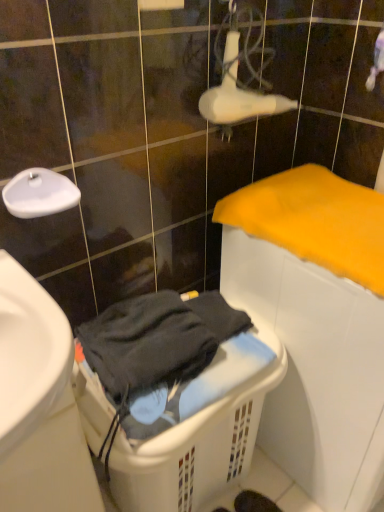
The height and width of the screenshot is (512, 384). Find the location of `white plastic laundry basket at lower center`. white plastic laundry basket at lower center is located at coordinates (174, 397).

The height and width of the screenshot is (512, 384). Find the location of `yellow soft cloth at right`. yellow soft cloth at right is located at coordinates (314, 221).

The width and height of the screenshot is (384, 512). Describe the element at coordinates (39, 193) in the screenshot. I see `white glossy faucet at upper left` at that location.

Where is `white plastic laundry basket at lower center`? The height and width of the screenshot is (512, 384). white plastic laundry basket at lower center is located at coordinates (174, 397).

Considering the relative sizes of white plastic laundry basket at lower center and white glossy faucet at upper left in the image provided, is white plastic laundry basket at lower center thinner than white glossy faucet at upper left?

No, white plastic laundry basket at lower center is not thinner than white glossy faucet at upper left.

Is white plastic laundry basket at lower center with white glossy faucet at upper left?

No, white plastic laundry basket at lower center is not making contact with white glossy faucet at upper left.

Can you confirm if white plastic laundry basket at lower center is smaller than white glossy faucet at upper left?

Incorrect, white plastic laundry basket at lower center is not smaller in size than white glossy faucet at upper left.

How much distance is there between white plastic laundry basket at lower center and white glossy faucet at upper left?

white plastic laundry basket at lower center is 20.87 inches away from white glossy faucet at upper left.

At what (x,y) coordinates should I click in order to perform the action: click on laundry basket below the white glossy faucet at upper left (from the image's perspective). Please return your answer as a coordinate pair (x, y). Looking at the image, I should click on (174, 397).

Is white glossy faucet at upper left not inside white plastic laundry basket at lower center?

Yes, white glossy faucet at upper left is not within white plastic laundry basket at lower center.

How far apart are white glossy faucet at upper left and white plastic laundry basket at lower center?

The distance of white glossy faucet at upper left from white plastic laundry basket at lower center is 20.87 inches.

Who is bigger, white glossy faucet at upper left or white plastic laundry basket at lower center?

Bigger between the two is white plastic laundry basket at lower center.

From the picture: Is there a large distance between yellow soft cloth at right and white plastic laundry basket at lower center?

No.

Which point is more distant from viewer, (261, 188) or (108, 468)?

The point (261, 188) is farther from the camera.

Is white glossy faucet at upper left oriented away from yellow soft cloth at right?

No, white glossy faucet at upper left is not facing away from yellow soft cloth at right.

Based on their sizes in the image, would you say white glossy faucet at upper left is bigger or smaller than yellow soft cloth at right?

In the image, white glossy faucet at upper left appears to be smaller than yellow soft cloth at right.

Between white glossy faucet at upper left and yellow soft cloth at right, which one appears on the left side from the viewer's perspective?

From the viewer's perspective, white glossy faucet at upper left appears more on the left side.

Is white plastic laundry basket at lower center shorter than yellow soft cloth at right?

No.

Is white plastic laundry basket at lower center facing away from yellow soft cloth at right?

white plastic laundry basket at lower center does not have its back to yellow soft cloth at right.

From the image's perspective, is white plastic laundry basket at lower center positioned above or below yellow soft cloth at right?

Clearly, from the image's perspective, white plastic laundry basket at lower center is below yellow soft cloth at right.

Is yellow soft cloth at right looking in the opposite direction of white glossy faucet at upper left?

yellow soft cloth at right does not have its back to white glossy faucet at upper left.

Are yellow soft cloth at right and white glossy faucet at upper left making contact?

No, yellow soft cloth at right is not next to white glossy faucet at upper left.

From the image's perspective, does yellow soft cloth at right appear higher than white glossy faucet at upper left?

Actually, yellow soft cloth at right appears below white glossy faucet at upper left in the image.

Is yellow soft cloth at right inside or outside of white glossy faucet at upper left?

The correct answer is: outside.

The image size is (384, 512). I want to click on laundry basket below the white glossy faucet at upper left (from a real-world perspective), so click(x=174, y=397).

Where is `faucet positioned vertically above the white plastic laundry basket at lower center (from a real-world perspective)`? faucet positioned vertically above the white plastic laundry basket at lower center (from a real-world perspective) is located at coordinates (39, 193).

Looking at the image, which one is located further to yellow soft cloth at right, white plastic laundry basket at lower center or white glossy faucet at upper left?

white glossy faucet at upper left is positioned further to the anchor yellow soft cloth at right.

Based on their spatial positions, is white glossy faucet at upper left or yellow soft cloth at right further from white plastic laundry basket at lower center?

white glossy faucet at upper left lies further to white plastic laundry basket at lower center than the other object.

Considering their positions, is white glossy faucet at upper left positioned closer to yellow soft cloth at right than white plastic laundry basket at lower center?

white plastic laundry basket at lower center lies closer to yellow soft cloth at right than the other object.

Which object lies nearer to the anchor point white glossy faucet at upper left, white plastic laundry basket at lower center or yellow soft cloth at right?

white plastic laundry basket at lower center.

From the image, which object appears to be farther from white plastic laundry basket at lower center, yellow soft cloth at right or white glossy faucet at upper left?

The object further to white plastic laundry basket at lower center is white glossy faucet at upper left.

Looking at the image, which one is located closer to white glossy faucet at upper left, yellow soft cloth at right or white plastic laundry basket at lower center?

Based on the image, white plastic laundry basket at lower center appears to be nearer to white glossy faucet at upper left.

At what (x,y) coordinates should I click in order to perform the action: click on laundry basket between white glossy faucet at upper left and yellow soft cloth at right from left to right. Please return your answer as a coordinate pair (x, y). This screenshot has height=512, width=384. Looking at the image, I should click on (174, 397).